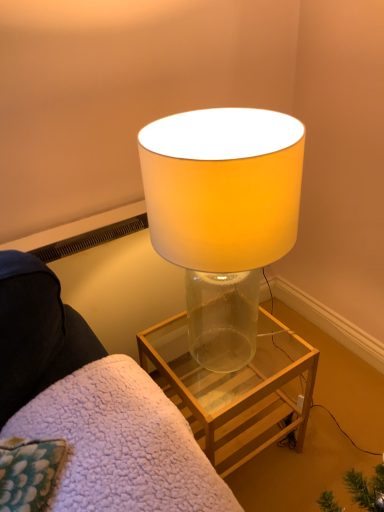
Question: From a real-world perspective, is transparent glass lamp at center positioned above or below clear glass table at center?

Choices:
 (A) below
 (B) above

Answer: (B)

Question: Is transparent glass lamp at center taller or shorter than clear glass table at center?

Choices:
 (A) tall
 (B) short

Answer: (B)

Question: Which of these objects is positioned closest to the translucent glass lamp at center?

Choices:
 (A) clear glass table at center
 (B) transparent glass lamp at center

Answer: (B)

Question: Estimate the real-world distances between objects in this image. Which object is closer to the clear glass table at center?

Choices:
 (A) translucent glass lamp at center
 (B) transparent glass lamp at center

Answer: (B)